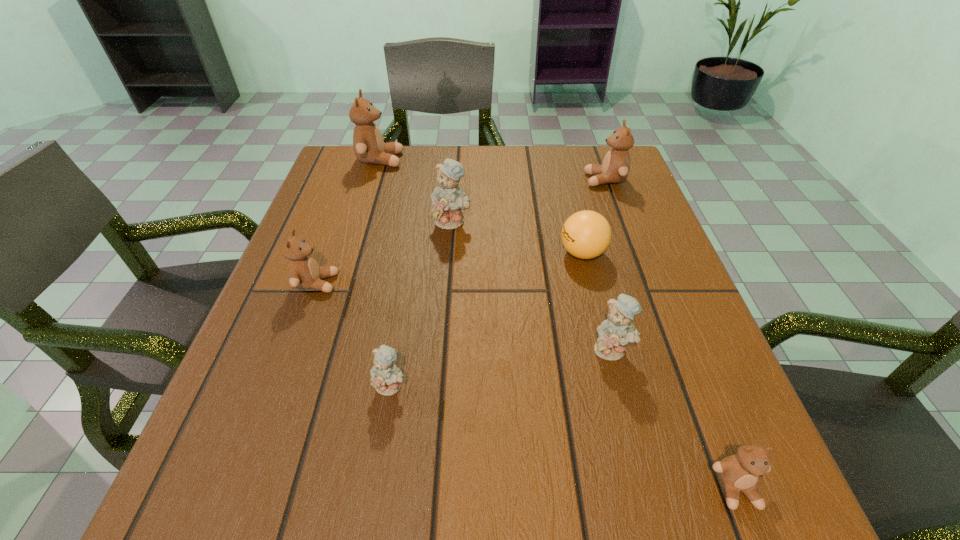
You are a GUI agent. You are given a task and a screenshot of the screen. Output one action in this format:
    pyautogui.click(x=<x>, y=<y>)
    Task: Click on the third teddy bear from left to right
    
    Given the screenshot: What is the action you would take?
    pyautogui.click(x=386, y=377)

Image resolution: width=960 pixels, height=540 pixels. In order to click on the nearest blue teddy bear in this screenshot , I will do `click(386, 377)`.

The image size is (960, 540). Find the location of `the nearest brown teddy bear`. the nearest brown teddy bear is located at coordinates (740, 472).

Where is `the nearest object`? The height and width of the screenshot is (540, 960). the nearest object is located at coordinates (740, 472).

The height and width of the screenshot is (540, 960). Find the location of `vacant region located 0.170m on the front-facing side of the tallest teddy bear`. vacant region located 0.170m on the front-facing side of the tallest teddy bear is located at coordinates (466, 160).

This screenshot has height=540, width=960. What are the coordinates of `vacant space located on the front-facing side of the second biggest brown teddy bear` in the screenshot? It's located at (554, 180).

This screenshot has width=960, height=540. In order to click on free location located 0.090m on the front-facing side of the second biggest brown teddy bear in this screenshot , I will do `click(549, 180)`.

The image size is (960, 540). I want to click on free space located on the front-facing side of the second biggest brown teddy bear, so click(545, 180).

The image size is (960, 540). Find the location of `vacant point located on the front-facing side of the fourth teddy bear from left to right`. vacant point located on the front-facing side of the fourth teddy bear from left to right is located at coordinates (444, 342).

Locate an element on the screen. The width and height of the screenshot is (960, 540). vacant area located 0.110m on the front-facing side of the fourth farthest teddy bear is located at coordinates (394, 283).